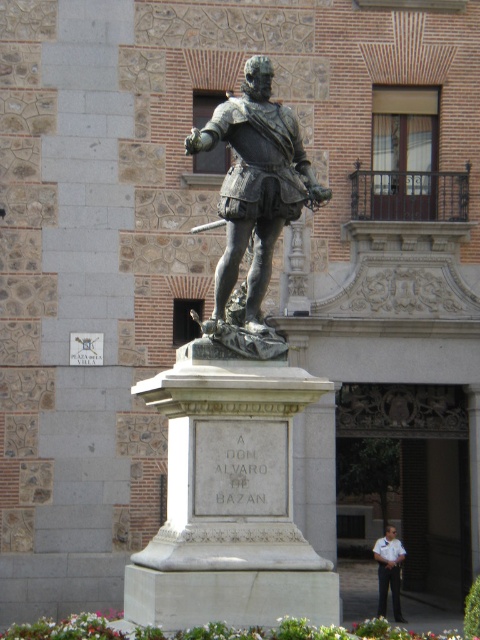
Can you confirm if bronze statue at center is positioned to the right of bronze armor at center?

In fact, bronze statue at center is to the left of bronze armor at center.

Looking at this image, who is more forward, (196, 448) or (237, 179)?

Positioned in front is point (196, 448).

At what (x,y) coordinates should I click in order to perform the action: click on bronze statue at center. Please return your answer as a coordinate pair (x, y). Looking at the image, I should click on (236, 412).

Which is more to the left, bronze statue at center or white uniform at center?

Positioned to the left is bronze statue at center.

Between point (254, 259) and point (403, 548), which one is positioned in front?

Point (254, 259) is in front.

Who is more distant from viewer, (x=224, y=604) or (x=381, y=609)?

Positioned behind is point (x=381, y=609).

What are the coordinates of `bronze statue at center` in the screenshot? It's located at (236, 412).

You are a GUI agent. You are given a task and a screenshot of the screen. Output one action in this format:
    pyautogui.click(x=<x>, y=<y>)
    Task: Click on the bronze armor at center
    This screenshot has height=640, width=480.
    Given the screenshot: What is the action you would take?
    pyautogui.click(x=255, y=186)

Where is `bronze armor at center`? Image resolution: width=480 pixels, height=640 pixels. bronze armor at center is located at coordinates (255, 186).